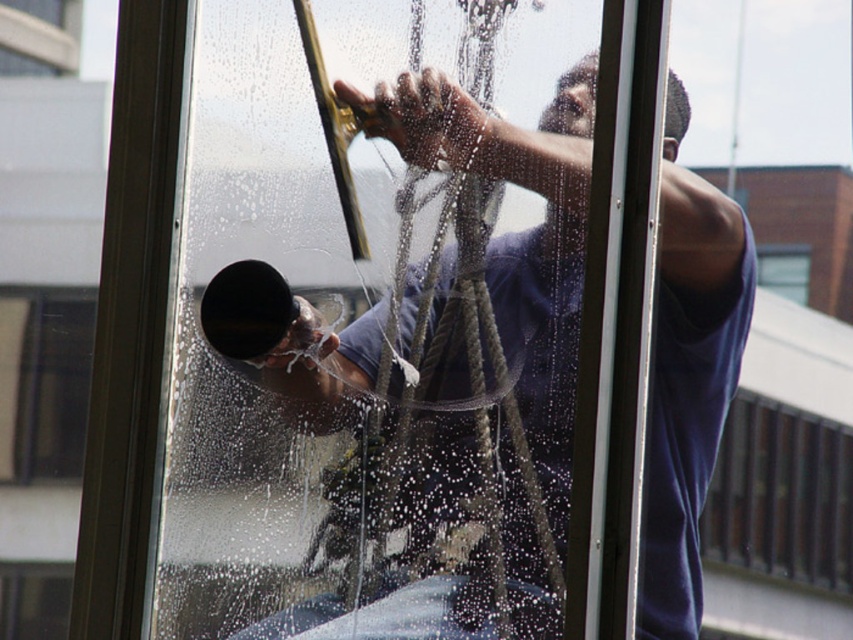
Question: Which of the following is the farthest from the observer?

Choices:
 (A) transparent glass window at upper center
 (B) dark blue shirt at center

Answer: (A)

Question: Can you confirm if dark blue shirt at center is positioned above transparent glass window at upper center?

Choices:
 (A) yes
 (B) no

Answer: (B)

Question: Which of the following is the closest to the observer?

Choices:
 (A) (660, 326)
 (B) (780, 282)

Answer: (B)

Question: Does dark blue shirt at center lie in front of transparent glass window at upper center?

Choices:
 (A) yes
 (B) no

Answer: (A)

Question: Does dark blue shirt at center come behind transparent glass window at upper center?

Choices:
 (A) no
 (B) yes

Answer: (A)